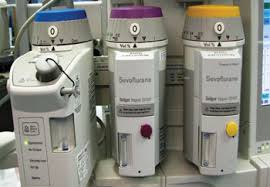
This screenshot has width=270, height=187. I want to click on computer screen, so click(x=261, y=63).